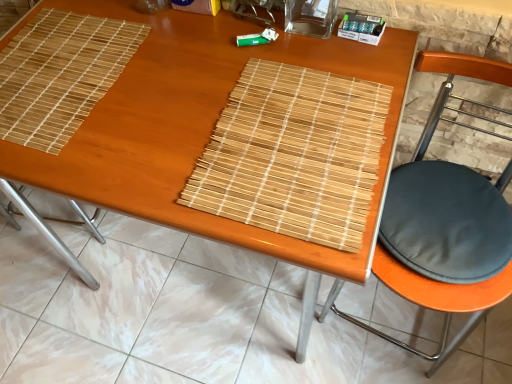
Where is `free spot below natural bamboo mat at center, positioned as the second mat in left-to-right order (from a real-world perspective)`? The height and width of the screenshot is (384, 512). free spot below natural bamboo mat at center, positioned as the second mat in left-to-right order (from a real-world perspective) is located at coordinates (297, 144).